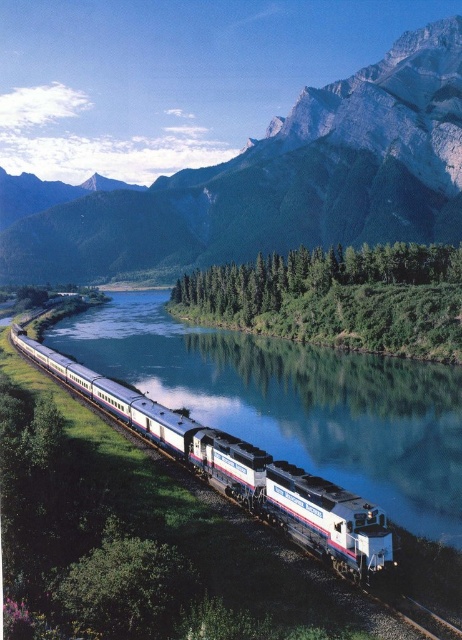
Question: Which point appears farthest from the camera in this image?

Choices:
 (A) (393, 600)
 (B) (109, 392)

Answer: (B)

Question: Does rugged granite mountain at upper center appear on the right side of green leafy trees at center?

Choices:
 (A) yes
 (B) no

Answer: (B)

Question: Which point is farther to the camera?

Choices:
 (A) white glossy train at center
 (B) metal train track at lower right
 (C) rugged granite mountain at upper center

Answer: (C)

Question: Which point is farther to the camera?

Choices:
 (A) metal train track at lower right
 (B) rugged granite mountain at upper center
 (C) green leafy trees at center

Answer: (B)

Question: Does rugged granite mountain at upper center appear on the right side of white glossy train at center?

Choices:
 (A) yes
 (B) no

Answer: (B)

Question: Observing the image, what is the correct spatial positioning of white glossy train at center in reference to metal train track at lower right?

Choices:
 (A) right
 (B) left

Answer: (B)